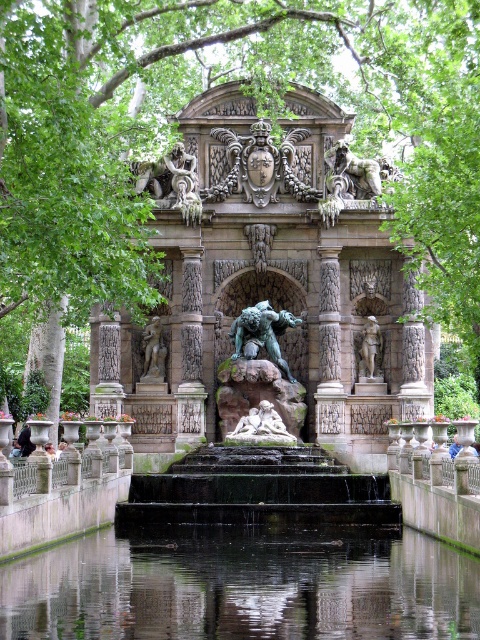
You are standing in front of the fountain and notice two points marked on the structure. The first point is at coordinates point [264,342] and the second is at point [146,360]. Which of these points is closer to your current position?

Point [264,342] is closer to the viewer than point [146,360].

You are a park visitor who wants to take a photo of the white marble reclining couple at center and the bronze statue at center. Which one should you focus on first if you want to capture both in the same frame without moving your camera?

The white marble reclining couple at center is positioned under the bronze statue at center, so you should focus on the bronze statue at center first to ensure both are in the frame.

You are standing in the park and see both the green patina stone statue at center and the bronze statue at center. Which one is positioned to the right of the other?

The green patina stone statue at center is to the right of the bronze statue at center.